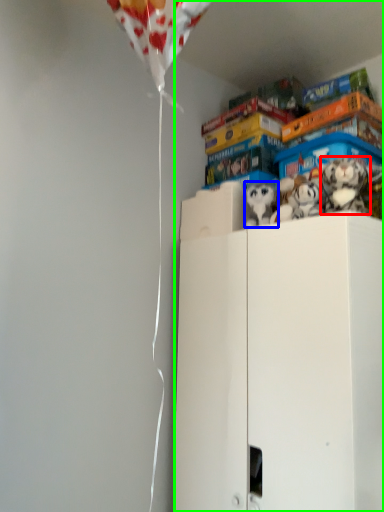
Question: Considering the real-world distances, which object is farthest from toy (highlighted by a red box)? toy (highlighted by a blue box) or cabinetry (highlighted by a green box)?

Choices:
 (A) toy
 (B) cabinetry

Answer: (B)